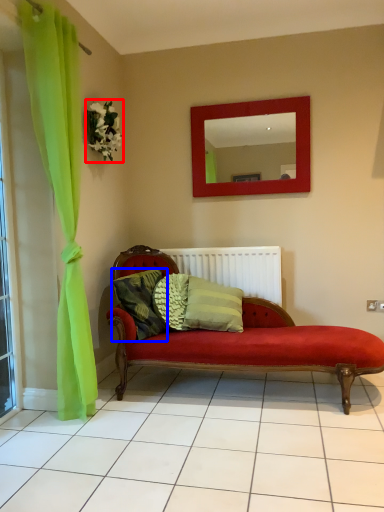
Question: Which of the following is the farthest to the observer, flower (highlighted by a red box) or pillow (highlighted by a blue box)?

Choices:
 (A) flower
 (B) pillow

Answer: (A)